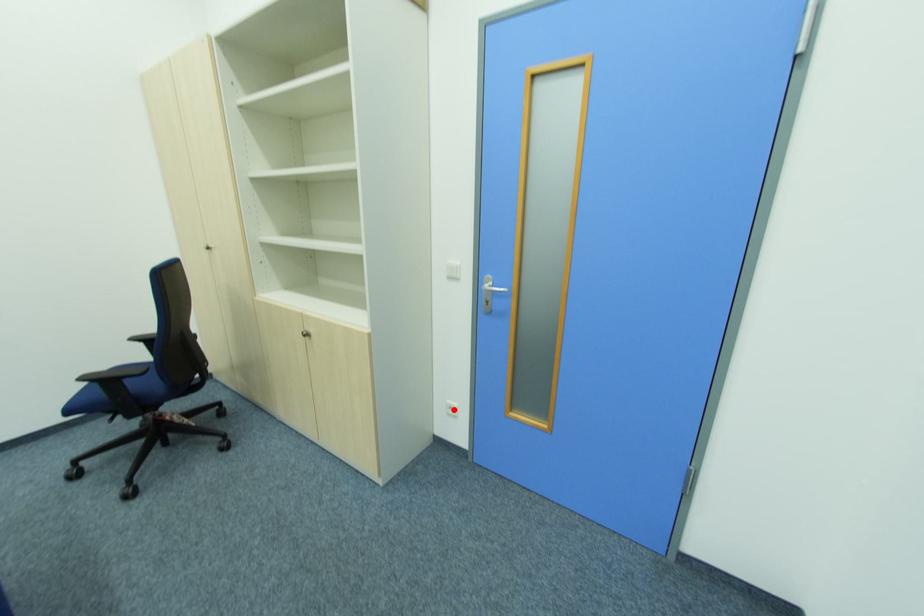
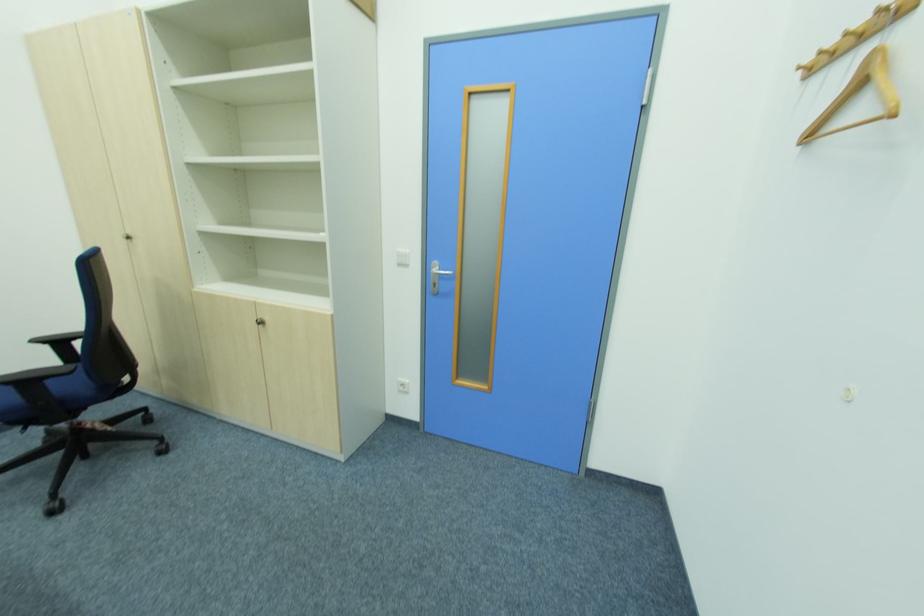
Where in the second image is the point corresponding to the highlighted location from the first image?

(407, 387)